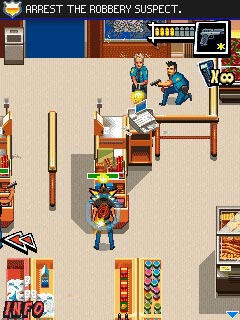
Locate an element on the screen. This screenshot has width=240, height=320. cash register is located at coordinates (148, 118).